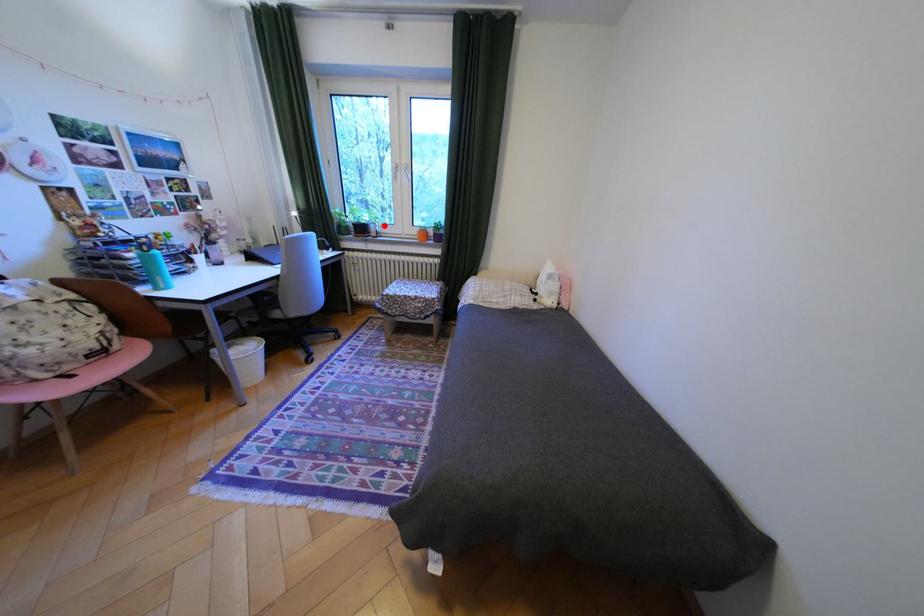
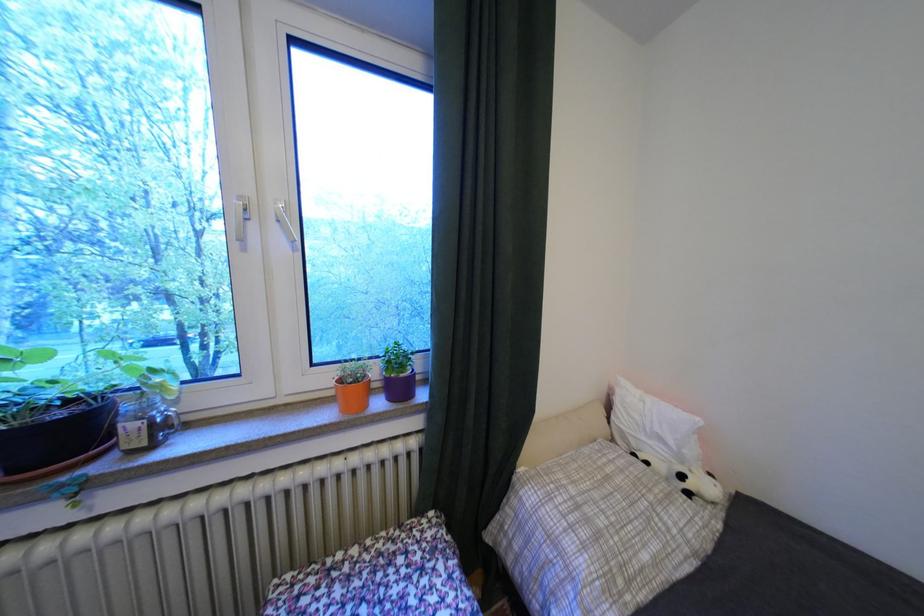
Question: I am providing you with two images of the same scene from different viewpoints. Image1 has a red point marked. In image2, the corresponding 3D location appears at what relative position? Reply with the corresponding letter.

Choices:
 (A) Closer
 (B) Farther

Answer: (B)